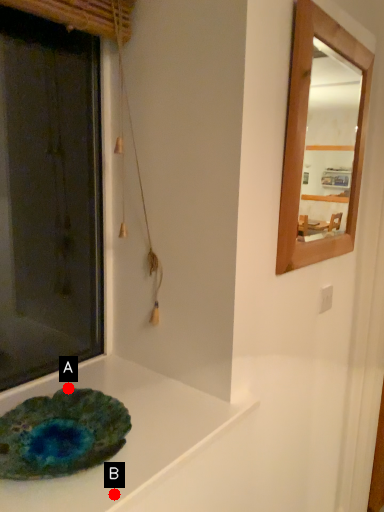
Question: Two points are circled on the image, labeled by A and B beside each circle. Among these points, which one is farthest from the camera?

Choices:
 (A) A is further
 (B) B is further

Answer: (A)